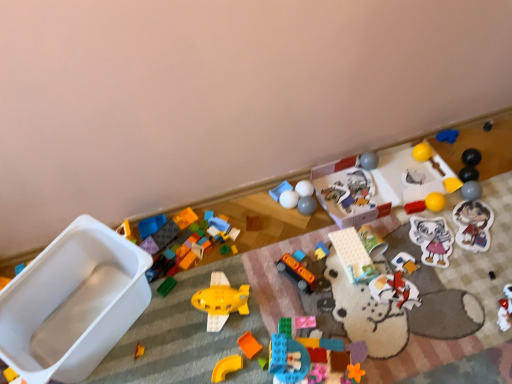
Image resolution: width=512 pixels, height=384 pixels. I want to click on empty space that is in between matte plastic stickers at lower right, which is counted as the third toy, starting from the right, and translucent plastic blocks at center, positioned as the 15th toy in right-to-left order, so click(x=400, y=294).